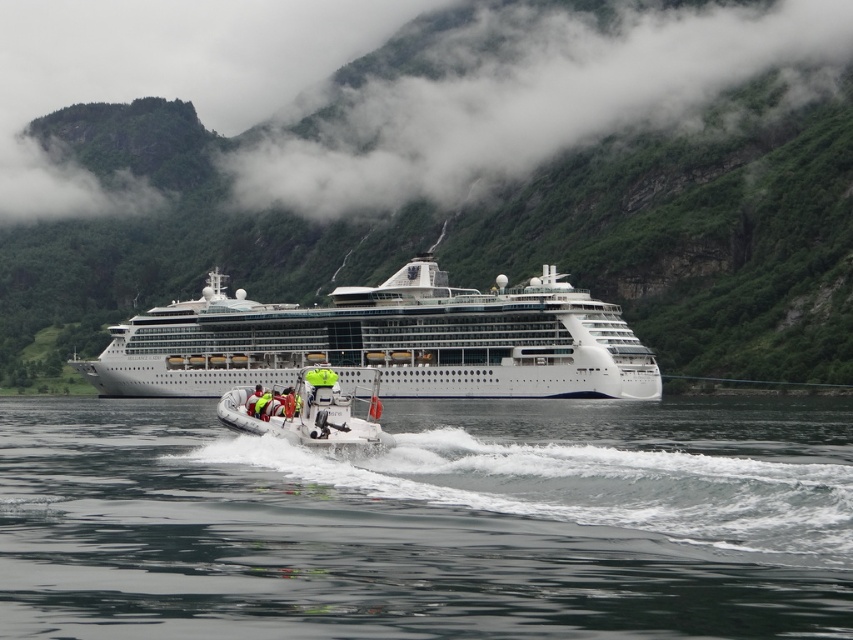
Question: Is white glossy cruise ship at center below white rubber dinghy at center?

Choices:
 (A) yes
 (B) no

Answer: (B)

Question: Which point is closer to the camera?

Choices:
 (A) white rubber dinghy at center
 (B) clear water at center
 (C) white glossy cruise ship at center

Answer: (B)

Question: Which is farther from the white glossy cruise ship at center?

Choices:
 (A) white rubber dinghy at center
 (B) clear water at center

Answer: (B)

Question: Is clear water at center further to the viewer compared to white rubber dinghy at center?

Choices:
 (A) yes
 (B) no

Answer: (B)

Question: Which point is farther from the camera taking this photo?

Choices:
 (A) (317, 388)
 (B) (509, 330)

Answer: (B)

Question: From the image, what is the correct spatial relationship of white glossy cruise ship at center in relation to white rubber dinghy at center?

Choices:
 (A) below
 (B) above

Answer: (B)